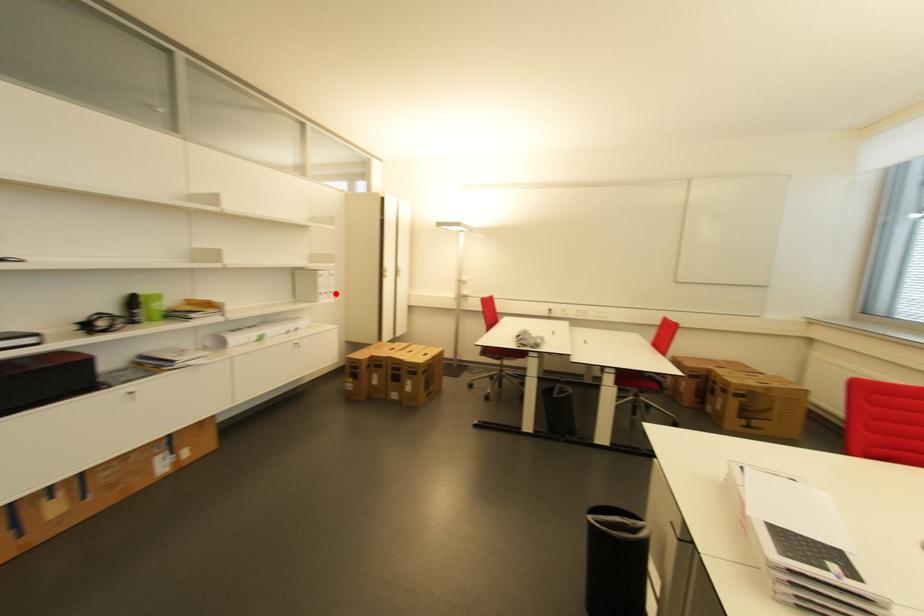
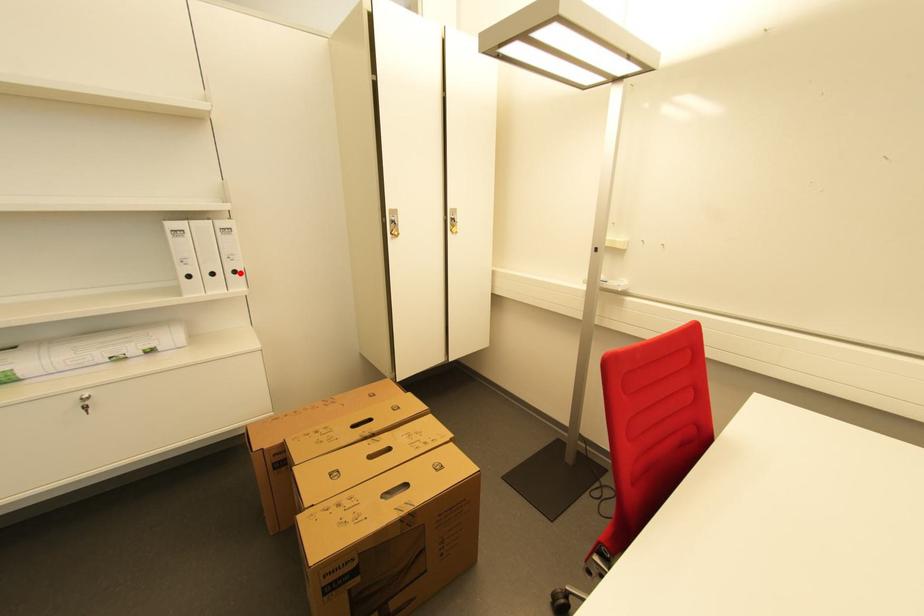
I am providing you with two images of the same scene from different viewpoints. A red point is marked on the first image and another point is marked on the second image. Are the points marked in image1 and image2 representing the same 3D position?

Yes